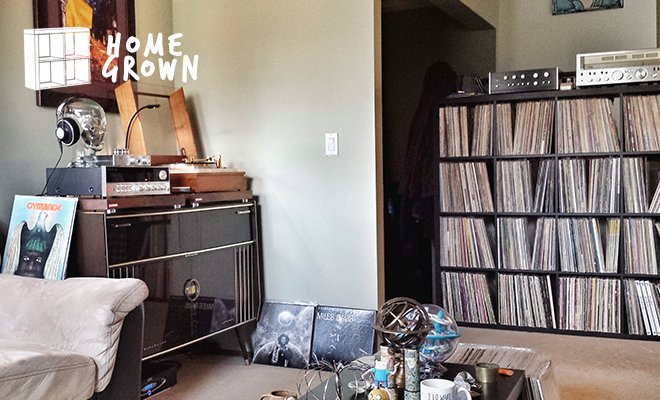
The image size is (660, 400). Find the location of `coffee mug`. coffee mug is located at coordinates (497, 113), (433, 390), (277, 394).